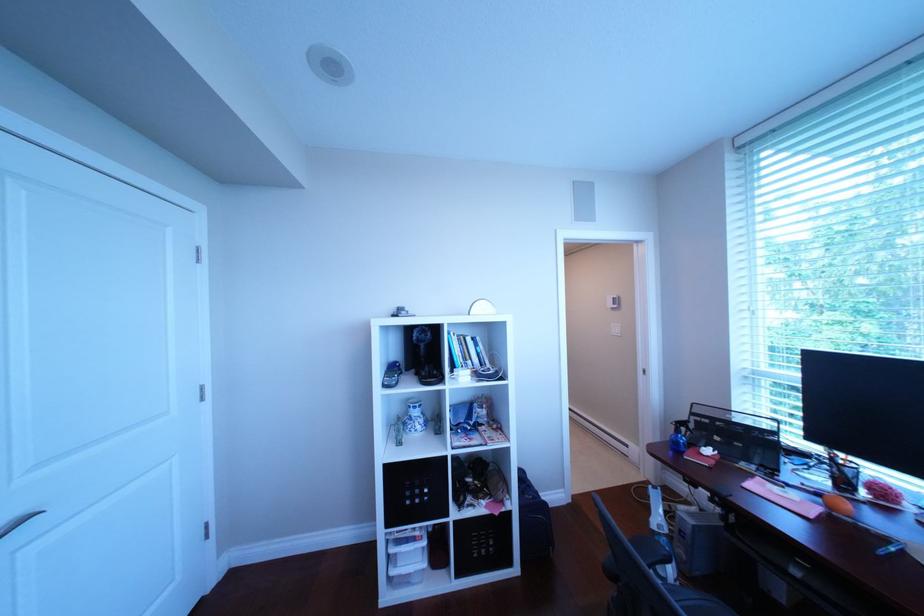
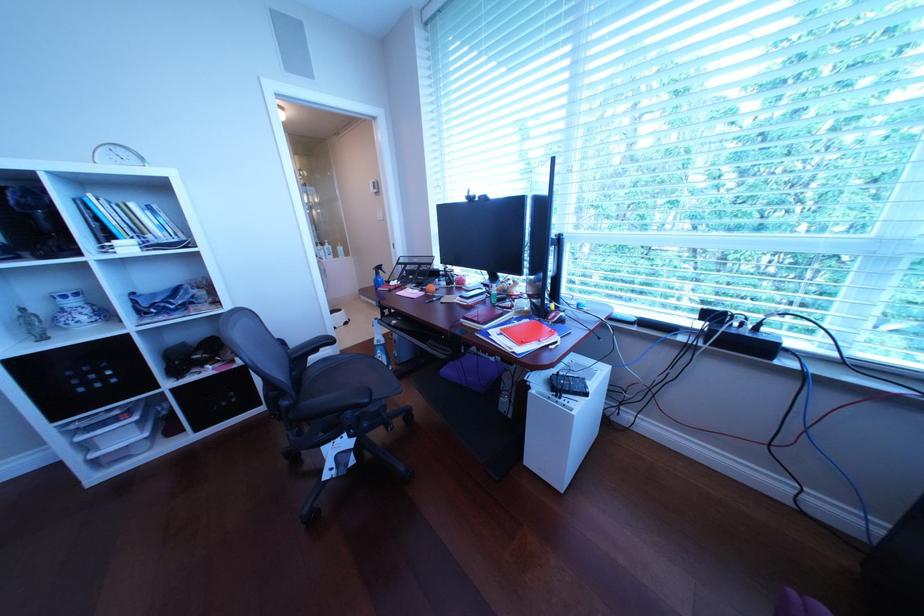
Based on the continuous images, in which direction is the camera rotating?

The camera rotated toward right-down.